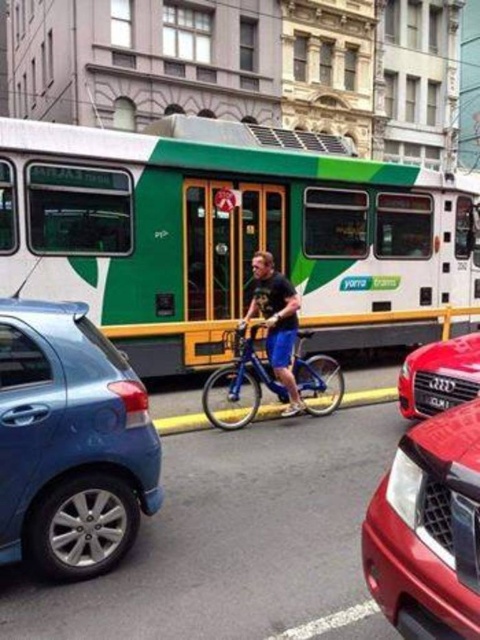
Is green matte bus at center to the right of shiny red audi at center from the viewer's perspective?

In fact, green matte bus at center is to the left of shiny red audi at center.

The height and width of the screenshot is (640, 480). Identify the location of green matte bus at center. (230, 232).

Find the location of a particular element. green matte bus at center is located at coordinates (230, 232).

Which is below, shiny red audi at center or black plastic license plate at center?

Positioned lower is black plastic license plate at center.

This screenshot has height=640, width=480. Describe the element at coordinates (439, 376) in the screenshot. I see `shiny red audi at center` at that location.

The height and width of the screenshot is (640, 480). Find the location of `shiny red audi at center`. shiny red audi at center is located at coordinates (439, 376).

Is matte black shirt at center below black plastic license plate at center?

No, matte black shirt at center is not below black plastic license plate at center.

Where is `matte black shirt at center`? Image resolution: width=480 pixels, height=640 pixels. matte black shirt at center is located at coordinates (276, 323).